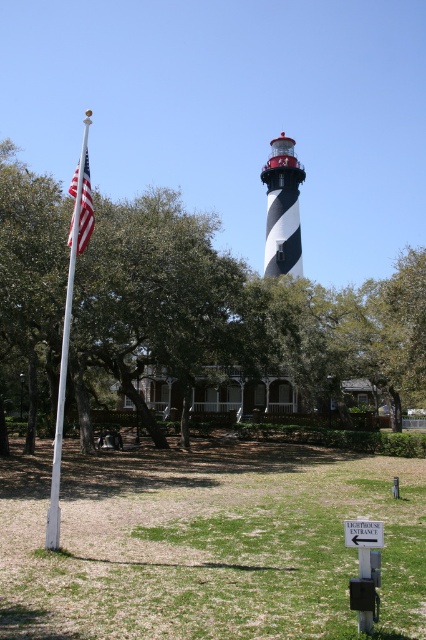
You are standing at the entrance of the lighthouse and want to take a photo that includes both the green leafy tree at left and the white painted wood flag pole at left. Which object should you frame first in your camera to ensure both are fully visible?

You should frame the green leafy tree at left first because it has a larger size compared to the white painted wood flag pole at left, so it requires more space in the frame to capture fully.

Based on the photo, you are standing at the entrance of the lighthouse and want to find the flagpole. Which object is closer to the entrance, the green leafy tree at left or the white painted wood flag pole at left?

The green leafy tree at left is below the white painted wood flag pole at left, so the white painted wood flag pole at left is closer to the entrance.